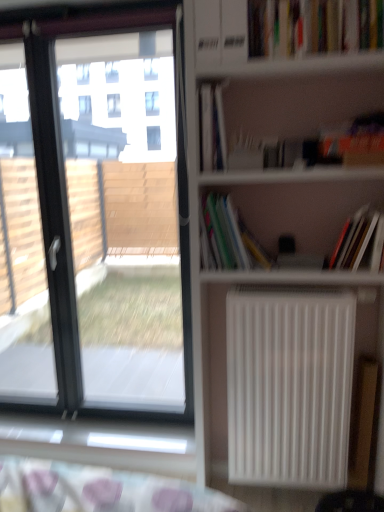
Locate an element on the screen. Image resolution: width=384 pixels, height=512 pixels. empty space that is ontop of transparent glass window at left (from a real-world perspective) is located at coordinates (104, 10).